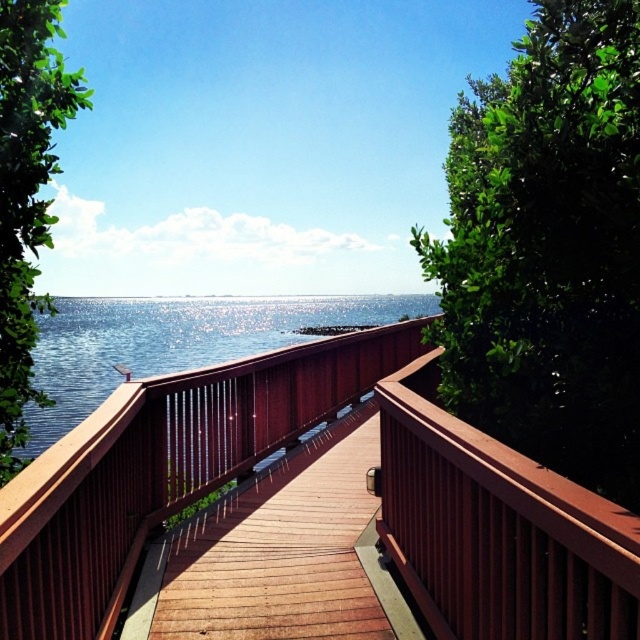
Question: Is wooden deck at center wider than shiny blue water at center?

Choices:
 (A) no
 (B) yes

Answer: (A)

Question: Among these points, which one is farthest from the camera?

Choices:
 (A) (38, 432)
 (B) (454, 385)

Answer: (A)

Question: Which of the following is the farthest from the observer?

Choices:
 (A) green leafy tree at right
 (B) green leafy tree at left
 (C) shiny blue water at center

Answer: (C)

Question: Which point is closer to the camera taking this photo?

Choices:
 (A) (550, 396)
 (B) (16, 48)

Answer: (B)

Question: Does wooden deck at center appear over shiny blue water at center?

Choices:
 (A) yes
 (B) no

Answer: (B)

Question: Does wooden deck at center appear over green leafy tree at right?

Choices:
 (A) no
 (B) yes

Answer: (A)